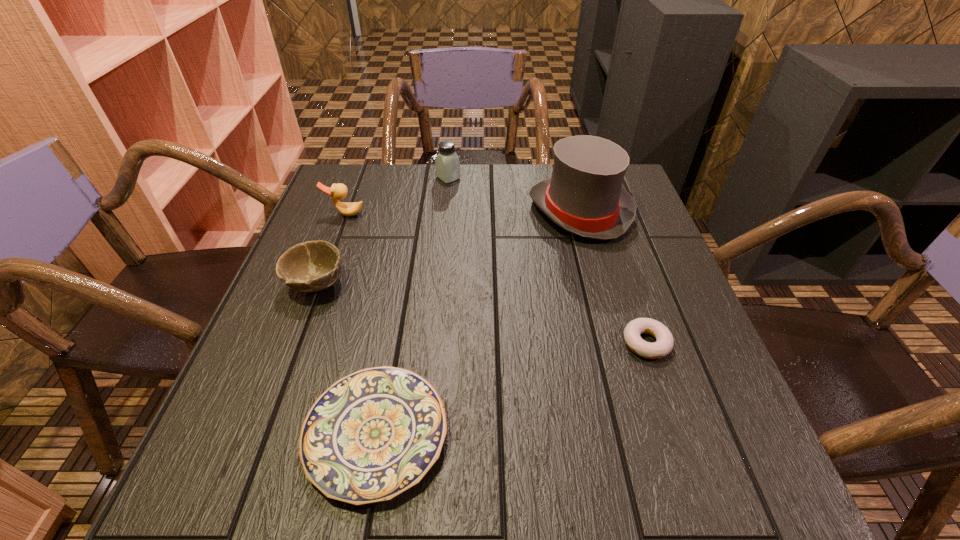
I want to click on the tallest object, so click(x=585, y=196).

Locate an element on the screen. The width and height of the screenshot is (960, 540). saltshaker is located at coordinates (447, 163).

Identify the location of duck. tap(338, 191).

Where is `bowl`? The height and width of the screenshot is (540, 960). bowl is located at coordinates (312, 266).

Image resolution: width=960 pixels, height=540 pixels. What are the coordinates of `the third nearest object` in the screenshot? It's located at (312, 266).

This screenshot has height=540, width=960. I want to click on doughnut, so click(664, 342).

The image size is (960, 540). Identify the location of the second shortest object. (664, 342).

At what (x,y) coordinates should I click in order to perform the action: click on plate. Please return your answer as a coordinate pair (x, y). This screenshot has height=540, width=960. Looking at the image, I should click on click(372, 435).

This screenshot has width=960, height=540. I want to click on the nearest object, so click(372, 435).

This screenshot has height=540, width=960. I want to click on vacant space positioned 0.390m on the front of the dress hat, so click(628, 386).